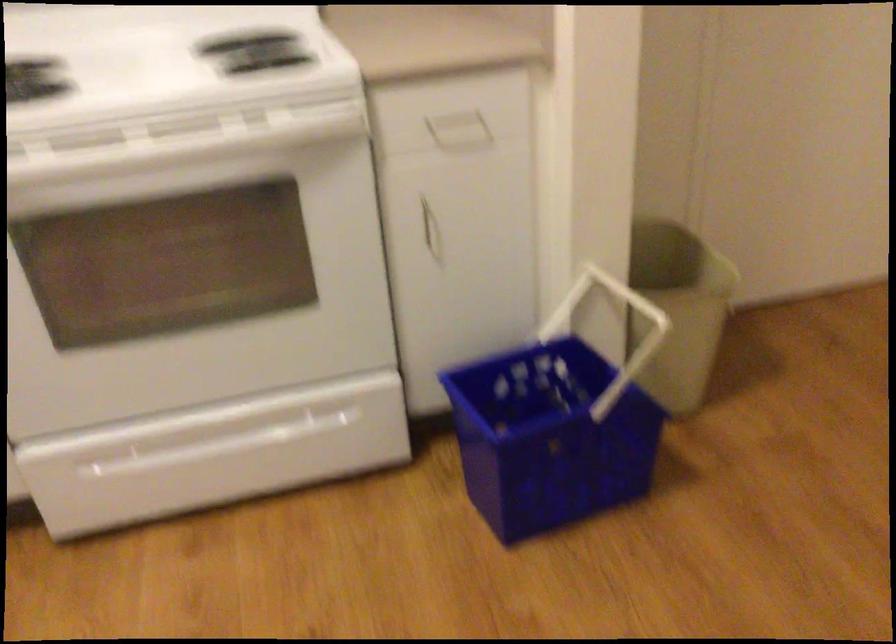
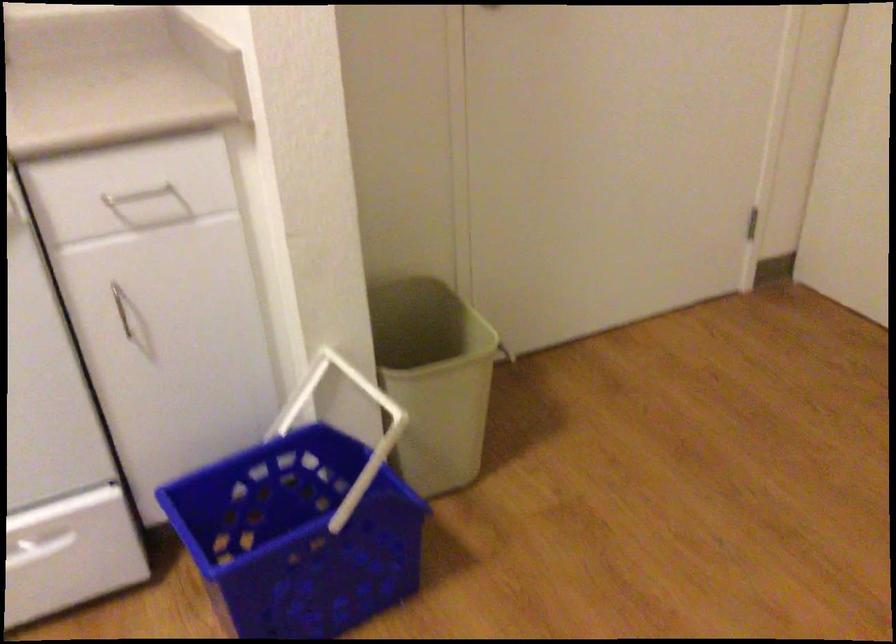
Locate, in the second image, the point that corresponds to the point at 419,212 in the first image.

(121, 307)